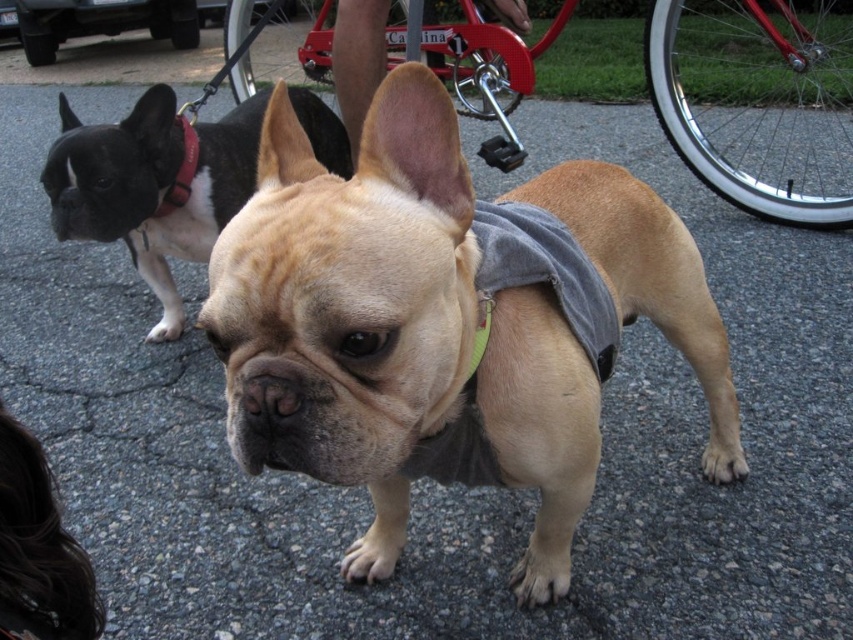
Question: Which point is farther from the camera taking this photo?

Choices:
 (A) (247, 186)
 (B) (193, 147)

Answer: (A)

Question: Based on their relative distances, which object is nearer to the black fur dog at left?

Choices:
 (A) red leather collar at upper left
 (B) matte tan french bulldog at center

Answer: (A)

Question: Can you confirm if matte tan french bulldog at center is smaller than red leather collar at upper left?

Choices:
 (A) no
 (B) yes

Answer: (A)

Question: Which of the following is the closest to the observer?

Choices:
 (A) (177, 205)
 (B) (405, 476)

Answer: (B)

Question: Can you confirm if black fur dog at left is positioned to the right of red leather collar at upper left?

Choices:
 (A) no
 (B) yes

Answer: (B)

Question: Is black fur dog at left closer to the viewer compared to red leather collar at upper left?

Choices:
 (A) no
 (B) yes

Answer: (B)